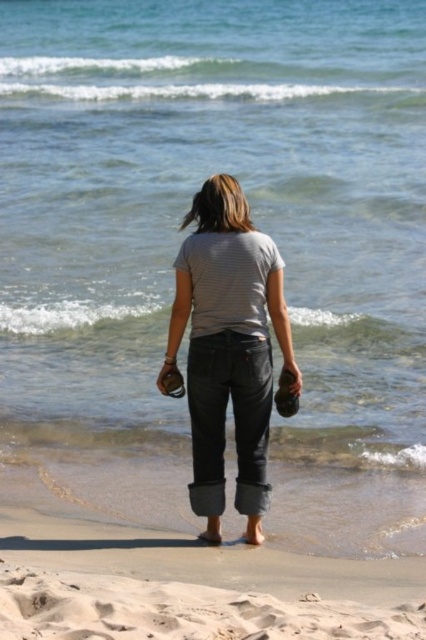
Question: Can you confirm if gray cotton shirt at center is positioned to the left of sandy beach at lower center?

Choices:
 (A) yes
 (B) no

Answer: (B)

Question: Is gray cotton shirt at center smaller than sandy beach at lower center?

Choices:
 (A) no
 (B) yes

Answer: (A)

Question: Which point is closer to the camera?

Choices:
 (A) sandy beach at lower center
 (B) gray cotton shirt at center

Answer: (A)

Question: Does gray cotton shirt at center appear on the right side of sandy beach at lower center?

Choices:
 (A) yes
 (B) no

Answer: (A)